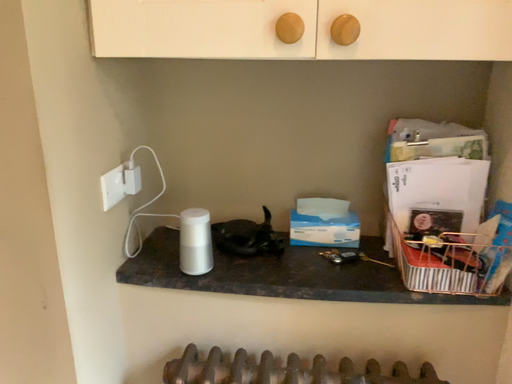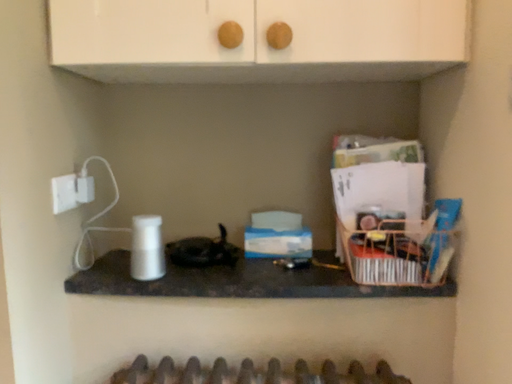
Question: How did the camera likely rotate when shooting the video?

Choices:
 (A) rotated downward
 (B) rotated upward

Answer: (B)